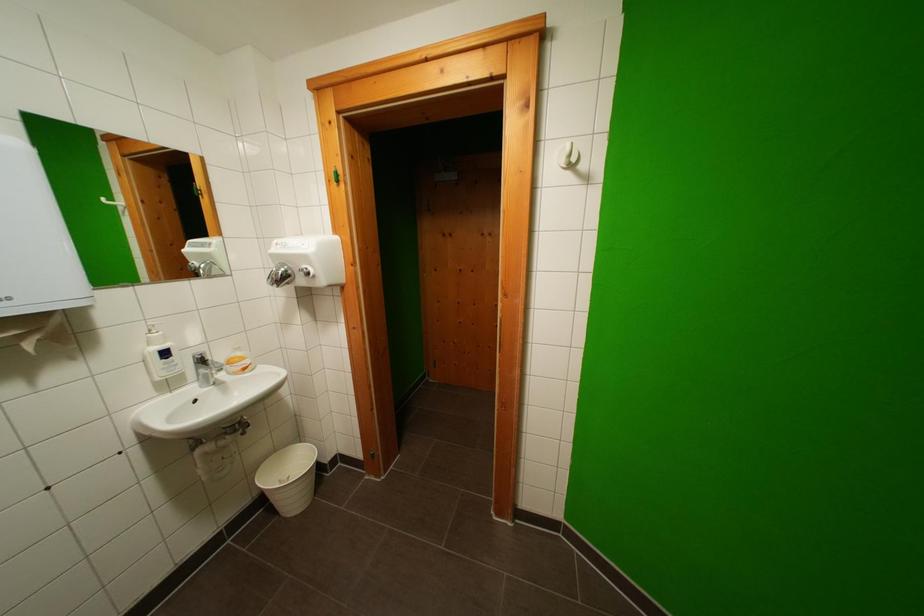
Find where to lift the white trash bin. Please return your answer as a coordinate pair (x, y).

(288, 477)